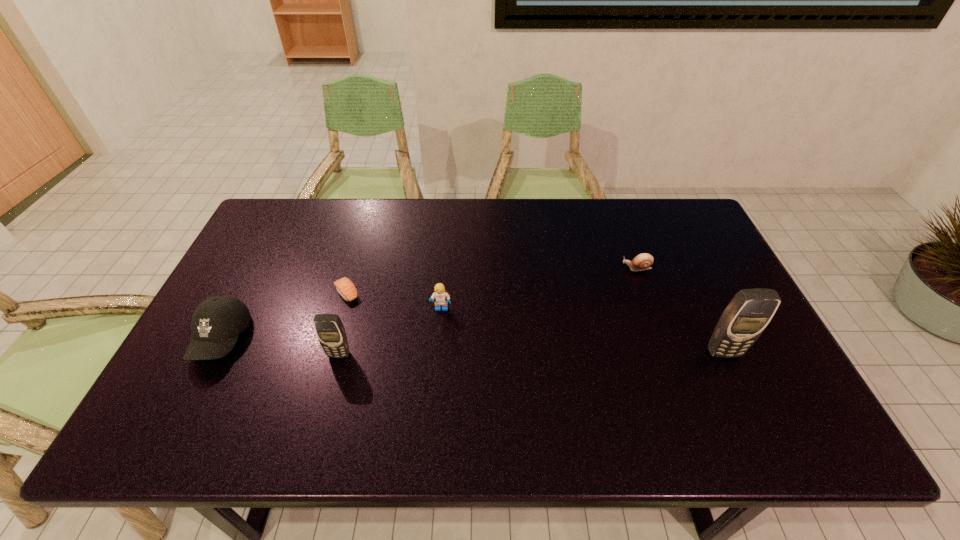
The width and height of the screenshot is (960, 540). I want to click on vacant area that satisfies the following two spatial constraints: 1. on the front-facing side of the escargot; 2. on the front face of the shorter cellular telephone, so click(x=667, y=354).